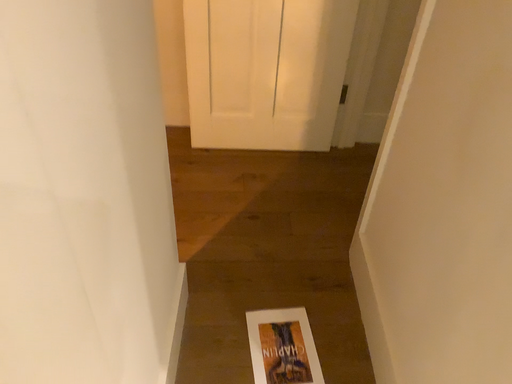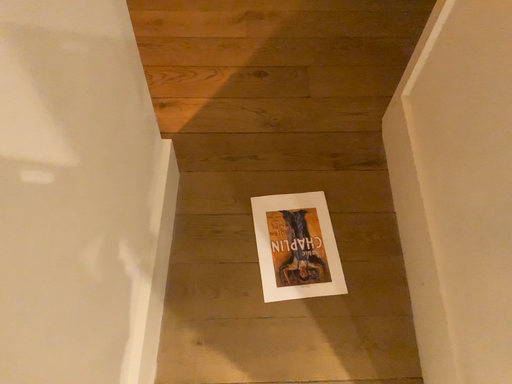
Question: How did the camera likely rotate when shooting the video?

Choices:
 (A) rotated upward
 (B) rotated downward

Answer: (B)